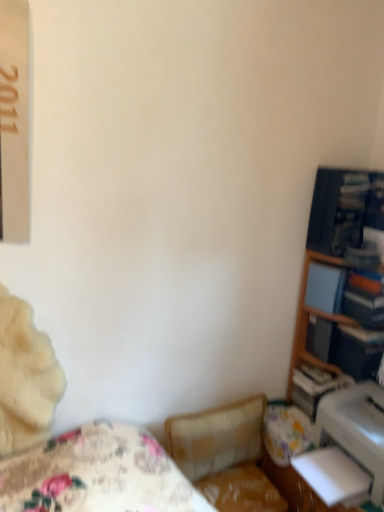
Question: From a real-world perspective, is wooden bookshelf at right beneath matte blue paperback book at right, the 2th paperback book when ordered from bottom to top?

Choices:
 (A) yes
 (B) no

Answer: (A)

Question: Is wooden bookshelf at right oriented away from matte blue paperback book at right, the 2th paperback book when ordered from bottom to top?

Choices:
 (A) yes
 (B) no

Answer: (A)

Question: Is wooden bookshelf at right taller than matte blue paperback book at right, which appears as the first paperback book when viewed from the left?

Choices:
 (A) yes
 (B) no

Answer: (A)

Question: Is wooden bookshelf at right positioned in front of matte blue paperback book at right, which appears as the first paperback book when viewed from the left?

Choices:
 (A) yes
 (B) no

Answer: (A)

Question: Is wooden bookshelf at right thinner than matte blue paperback book at right, which appears as the first paperback book when viewed from the left?

Choices:
 (A) yes
 (B) no

Answer: (B)

Question: Is matte blue paperback book at right, the 2th paperback book when ordered from bottom to top, spatially inside white glossy printer at lower right, or outside of it?

Choices:
 (A) inside
 (B) outside

Answer: (B)

Question: Relative to white glossy printer at lower right, is matte blue paperback book at right, the second paperback book viewed from the right, in front or behind?

Choices:
 (A) behind
 (B) front

Answer: (A)

Question: From a real-world perspective, is matte blue paperback book at right, which appears as the first paperback book when viewed from the left, physically located above or below white glossy printer at lower right?

Choices:
 (A) above
 (B) below

Answer: (A)

Question: Would you say matte blue paperback book at right, the second paperback book viewed from the right, is to the left or to the right of white glossy printer at lower right in the picture?

Choices:
 (A) right
 (B) left

Answer: (B)

Question: Which is correct: plush beige swivel chair at center is inside wooden bookshelf at right, or outside of it?

Choices:
 (A) outside
 (B) inside

Answer: (A)

Question: Is plush beige swivel chair at center taller or shorter than wooden bookshelf at right?

Choices:
 (A) tall
 (B) short

Answer: (B)

Question: Is point (192, 451) positioned closer to the camera than point (362, 259)?

Choices:
 (A) closer
 (B) farther

Answer: (A)

Question: From a real-world perspective, relative to wooden bookshelf at right, is plush beige swivel chair at center vertically above or below?

Choices:
 (A) below
 (B) above

Answer: (A)

Question: In the image, is hardcover book at right, which is counted as the first paperback book, starting from the right, positioned in front of or behind white glossy printer at lower right?

Choices:
 (A) behind
 (B) front

Answer: (A)

Question: Looking at the image, does hardcover book at right, placed as the 2th paperback book when sorted from top to bottom, seem bigger or smaller compared to white glossy printer at lower right?

Choices:
 (A) small
 (B) big

Answer: (A)